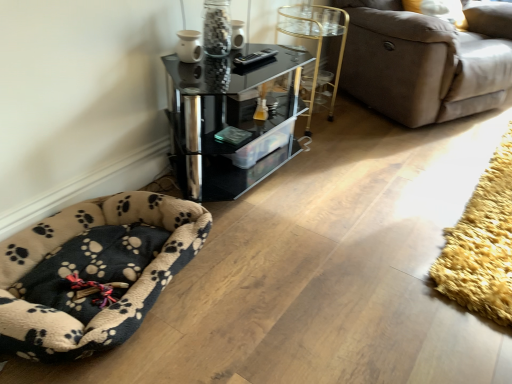
Where is `free space in front of brown fabric couch at upper right`? This screenshot has width=512, height=384. free space in front of brown fabric couch at upper right is located at coordinates (414, 159).